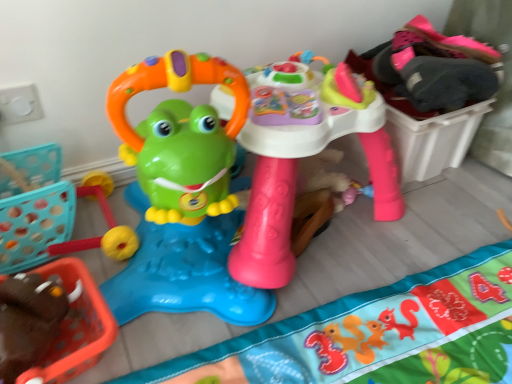
Image resolution: width=512 pixels, height=384 pixels. Describe the element at coordinates (376, 335) in the screenshot. I see `soft fabric play mat at center` at that location.

In order to face matte plastic activity table at center, placed as the 1th toy when sorted from right to left, should I rotate leftwards or rightwards?

A 8.538 degree turn to the right will do.

The width and height of the screenshot is (512, 384). What are the coordinates of `matte plastic frog walker at center, the 1th toy in the left-to-right sequence` in the screenshot? It's located at [183, 196].

Locate an element on the screen. Image resolution: width=512 pixels, height=384 pixels. soft fabric play mat at center is located at coordinates (376, 335).

Looking at this image, is matte plastic frog walker at center, the second toy from the right, to the left of matte plastic activity table at center, which is the second toy from left to right, from the viewer's perspective?

Yes, matte plastic frog walker at center, the second toy from the right, is to the left of matte plastic activity table at center, which is the second toy from left to right.

Is matte plastic frog walker at center, the second toy from the right, looking in the opposite direction of matte plastic activity table at center, placed as the 1th toy when sorted from right to left?

matte plastic frog walker at center, the second toy from the right, does not have its back to matte plastic activity table at center, placed as the 1th toy when sorted from right to left.

Considering their positions, is matte plastic frog walker at center, the second toy from the right, located in front of or behind matte plastic activity table at center, placed as the 1th toy when sorted from right to left?

In the image, matte plastic frog walker at center, the second toy from the right, appears in front of matte plastic activity table at center, placed as the 1th toy when sorted from right to left.

Between matte plastic frog walker at center, the 1th toy in the left-to-right sequence, and soft fabric play mat at center, which one has smaller width?

matte plastic frog walker at center, the 1th toy in the left-to-right sequence, is thinner.

In the scene shown: From a real-world perspective, is matte plastic frog walker at center, the 1th toy in the left-to-right sequence, physically above soft fabric play mat at center?

Yes.

Measure the distance from matte plastic frog walker at center, the 1th toy in the left-to-right sequence, to soft fabric play mat at center.

The distance of matte plastic frog walker at center, the 1th toy in the left-to-right sequence, from soft fabric play mat at center is 11.51 inches.

Considering the positions of objects matte plastic frog walker at center, the 1th toy in the left-to-right sequence, and soft fabric play mat at center in the image provided, who is more to the left, matte plastic frog walker at center, the 1th toy in the left-to-right sequence, or soft fabric play mat at center?

matte plastic frog walker at center, the 1th toy in the left-to-right sequence.

From a real-world perspective, is soft fabric play mat at center on matte plastic frog walker at center, the second toy from the right?

No, from a real-world perspective, soft fabric play mat at center is not over matte plastic frog walker at center, the second toy from the right

Considering the relative sizes of soft fabric play mat at center and matte plastic frog walker at center, the second toy from the right, in the image provided, is soft fabric play mat at center thinner than matte plastic frog walker at center, the second toy from the right,?

No.

Can you confirm if soft fabric play mat at center is smaller than matte plastic frog walker at center, the second toy from the right?

Yes.

Considering the relative positions of soft fabric play mat at center and matte plastic frog walker at center, the 1th toy in the left-to-right sequence, in the image provided, is soft fabric play mat at center to the right of matte plastic frog walker at center, the 1th toy in the left-to-right sequence, from the viewer's perspective?

Yes, soft fabric play mat at center is to the right of matte plastic frog walker at center, the 1th toy in the left-to-right sequence.

Between soft fabric play mat at center and matte plastic activity table at center, placed as the 1th toy when sorted from right to left, which one has smaller size?

Smaller between the two is soft fabric play mat at center.

From the image's perspective, is soft fabric play mat at center above or below matte plastic activity table at center, placed as the 1th toy when sorted from right to left?

Based on their image positions, soft fabric play mat at center is located beneath matte plastic activity table at center, placed as the 1th toy when sorted from right to left.

Considering their positions, is soft fabric play mat at center located in front of or behind matte plastic activity table at center, which is the second toy from left to right?

In the image, soft fabric play mat at center appears in front of matte plastic activity table at center, which is the second toy from left to right.

Is matte plastic activity table at center, which is the second toy from left to right, positioned far away from matte plastic frog walker at center, the second toy from the right?

matte plastic activity table at center, which is the second toy from left to right, is near matte plastic frog walker at center, the second toy from the right, not far away.

Which is in front, point (341, 63) or point (237, 222)?

The point (237, 222) is more forward.

Is matte plastic activity table at center, which is the second toy from left to right, situated inside matte plastic frog walker at center, the 1th toy in the left-to-right sequence, or outside?

matte plastic activity table at center, which is the second toy from left to right, exists outside the volume of matte plastic frog walker at center, the 1th toy in the left-to-right sequence.

How far apart are matte plastic activity table at center, which is the second toy from left to right, and matte plastic frog walker at center, the 1th toy in the left-to-right sequence?

A distance of 6.98 inches exists between matte plastic activity table at center, which is the second toy from left to right, and matte plastic frog walker at center, the 1th toy in the left-to-right sequence.

Is matte plastic activity table at center, which is the second toy from left to right, positioned with its back to soft fabric play mat at center?

matte plastic activity table at center, which is the second toy from left to right, is not turned away from soft fabric play mat at center.

Based on their sizes in the image, would you say matte plastic activity table at center, placed as the 1th toy when sorted from right to left, is bigger or smaller than soft fabric play mat at center?

In the image, matte plastic activity table at center, placed as the 1th toy when sorted from right to left, appears to be larger than soft fabric play mat at center.

From a real-world perspective, which is physically below, matte plastic activity table at center, which is the second toy from left to right, or soft fabric play mat at center?

soft fabric play mat at center is physically lower.

Is matte plastic activity table at center, placed as the 1th toy when sorted from right to left, with soft fabric play mat at center?

No, matte plastic activity table at center, placed as the 1th toy when sorted from right to left, is not making contact with soft fabric play mat at center.

Where is `toy above the matte plastic activity table at center, placed as the 1th toy when sorted from right to left (from a real-world perspective)`? Image resolution: width=512 pixels, height=384 pixels. toy above the matte plastic activity table at center, placed as the 1th toy when sorted from right to left (from a real-world perspective) is located at coordinates (183, 196).

The width and height of the screenshot is (512, 384). I want to click on blanket on the right of matte plastic frog walker at center, the 1th toy in the left-to-right sequence, so click(x=376, y=335).

Considering their positions, is matte plastic activity table at center, which is the second toy from left to right, positioned closer to soft fabric play mat at center than matte plastic frog walker at center, the 1th toy in the left-to-right sequence?

The object closer to soft fabric play mat at center is matte plastic activity table at center, which is the second toy from left to right.

Looking at the image, which one is located closer to matte plastic activity table at center, placed as the 1th toy when sorted from right to left, matte plastic frog walker at center, the second toy from the right, or soft fabric play mat at center?

Based on the image, matte plastic frog walker at center, the second toy from the right, appears to be nearer to matte plastic activity table at center, placed as the 1th toy when sorted from right to left.

When comparing their distances from matte plastic frog walker at center, the second toy from the right, does soft fabric play mat at center or matte plastic activity table at center, which is the second toy from left to right, seem further?

soft fabric play mat at center is further to matte plastic frog walker at center, the second toy from the right.

Which object lies further to the anchor point matte plastic frog walker at center, the 1th toy in the left-to-right sequence, matte plastic activity table at center, which is the second toy from left to right, or soft fabric play mat at center?

soft fabric play mat at center.

Which object lies nearer to the anchor point soft fabric play mat at center, matte plastic frog walker at center, the 1th toy in the left-to-right sequence, or matte plastic activity table at center, which is the second toy from left to right?

matte plastic activity table at center, which is the second toy from left to right, is closer to soft fabric play mat at center.

Looking at the image, which one is located closer to matte plastic activity table at center, placed as the 1th toy when sorted from right to left, soft fabric play mat at center or matte plastic frog walker at center, the 1th toy in the left-to-right sequence?

matte plastic frog walker at center, the 1th toy in the left-to-right sequence, is positioned closer to the anchor matte plastic activity table at center, placed as the 1th toy when sorted from right to left.

You are a GUI agent. You are given a task and a screenshot of the screen. Output one action in this format:
    pyautogui.click(x=<x>, y=<y>)
    Task: Click on the toy between matte plastic activity table at center, which is the second toy from left to right, and soft fabric play mat at center vertically
    
    Given the screenshot: What is the action you would take?
    pyautogui.click(x=183, y=196)